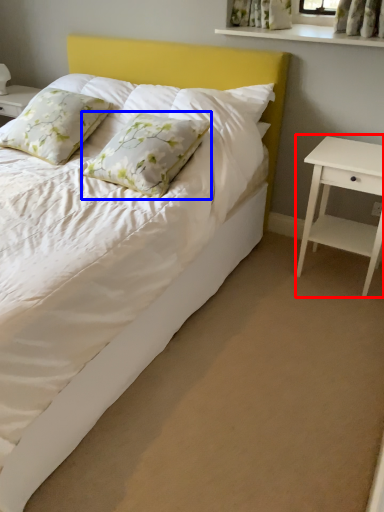
Question: Which point is closer to the camera, nightstand (highlighted by a red box) or pillow (highlighted by a blue box)?

Choices:
 (A) nightstand
 (B) pillow

Answer: (B)